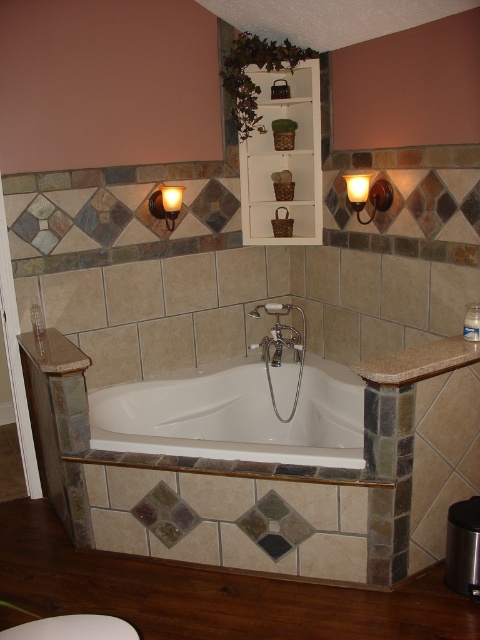
Does matte gold sconce at upper right appear over matte gold sconce at upper left?

Indeed, matte gold sconce at upper right is positioned over matte gold sconce at upper left.

Does matte gold sconce at upper right come behind matte gold sconce at upper left?

No, it is in front of matte gold sconce at upper left.

Does point (368, 184) come behind point (156, 192)?

No, it is in front of (156, 192).

The image size is (480, 640). Find the location of `matte gold sconce at upper right`. matte gold sconce at upper right is located at coordinates click(368, 195).

Between white glossy bathtub at center and matte gold sconce at upper left, which one has more height?

With more height is white glossy bathtub at center.

Does white glossy bathtub at center appear on the left side of matte gold sconce at upper left?

Incorrect, white glossy bathtub at center is not on the left side of matte gold sconce at upper left.

Identify the location of white glossy bathtub at center. This screenshot has width=480, height=640. (235, 417).

Where is `white glossy bathtub at center`? The width and height of the screenshot is (480, 640). white glossy bathtub at center is located at coordinates (235, 417).

The width and height of the screenshot is (480, 640). Describe the element at coordinates (72, 628) in the screenshot. I see `white glossy toilet bowl at lower left` at that location.

Between white glossy toilet bowl at lower left and matte gold sconce at upper right, which one appears on the right side from the viewer's perspective?

matte gold sconce at upper right is more to the right.

Image resolution: width=480 pixels, height=640 pixels. Find the location of `white glossy toilet bowl at lower left`. white glossy toilet bowl at lower left is located at coordinates (72, 628).

Where is `white glossy toilet bowl at lower left`? white glossy toilet bowl at lower left is located at coordinates (72, 628).